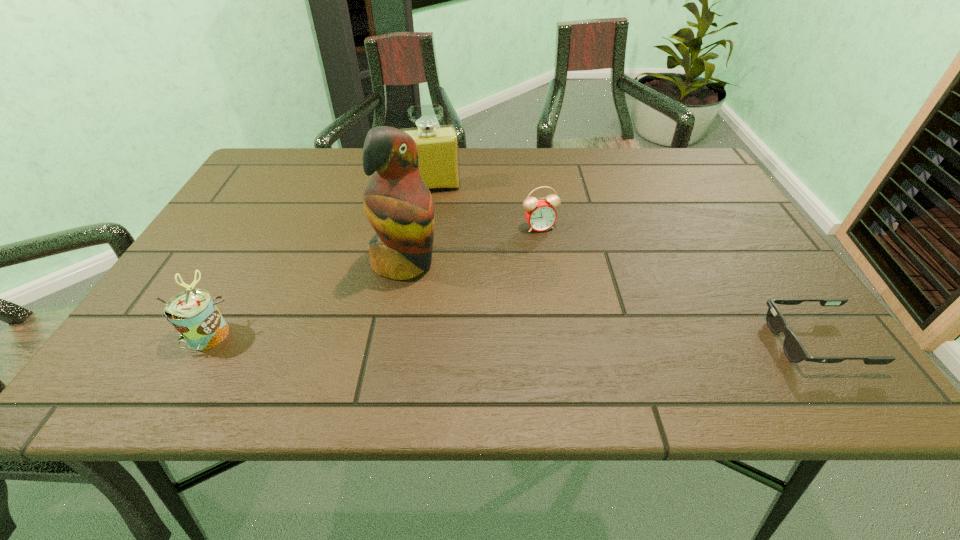
This screenshot has width=960, height=540. Find the location of `blank space at the far edge of the desktop`. blank space at the far edge of the desktop is located at coordinates pos(584,168).

Where is `free spot at the near edge of the desktop`? free spot at the near edge of the desktop is located at coordinates (492, 335).

In the image, there is a desktop. At what (x,y) coordinates should I click in order to perform the action: click on vacant space at the left edge. Please return your answer as a coordinate pair (x, y). Looking at the image, I should click on (271, 237).

In the image, there is a desktop. At what (x,y) coordinates should I click in order to perform the action: click on free space at the right edge. Please return your answer as a coordinate pair (x, y). This screenshot has height=540, width=960. Looking at the image, I should click on (718, 199).

Locate an element on the screen. The height and width of the screenshot is (540, 960). vacant space at the far right corner of the desktop is located at coordinates (659, 153).

You are a GUI agent. You are given a task and a screenshot of the screen. Output one action in this format:
    pyautogui.click(x=<x>, y=<y>)
    Task: Click on the vacant space at the near right corner of the desktop
    The image size is (960, 540).
    Given the screenshot: What is the action you would take?
    pyautogui.click(x=766, y=328)

Where is `empty space between the farthest object and the can`? empty space between the farthest object and the can is located at coordinates (321, 260).

Where is `vacant point located between the leftmost object and the perfume`? Image resolution: width=960 pixels, height=540 pixels. vacant point located between the leftmost object and the perfume is located at coordinates (321, 260).

This screenshot has height=540, width=960. What are the coordinates of `free spot between the second shortest object and the sunglasses` in the screenshot? It's located at (678, 284).

Identify the location of unoccupied area between the farthest object and the shortest object. (624, 264).